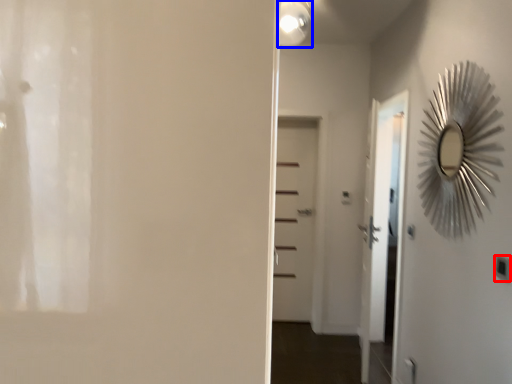
Question: Which object is closer to the camera taking this photo, light switch (highlighted by a red box) or light fixture (highlighted by a blue box)?

Choices:
 (A) light switch
 (B) light fixture

Answer: (A)